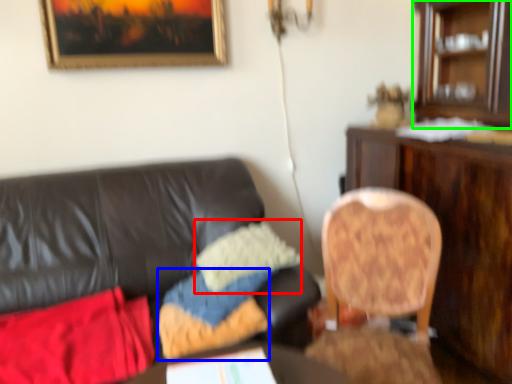
Question: Which is nearer to the pillow (highlighted by a red box)? pillow (highlighted by a blue box) or cabinetry (highlighted by a green box).

Choices:
 (A) pillow
 (B) cabinetry

Answer: (A)